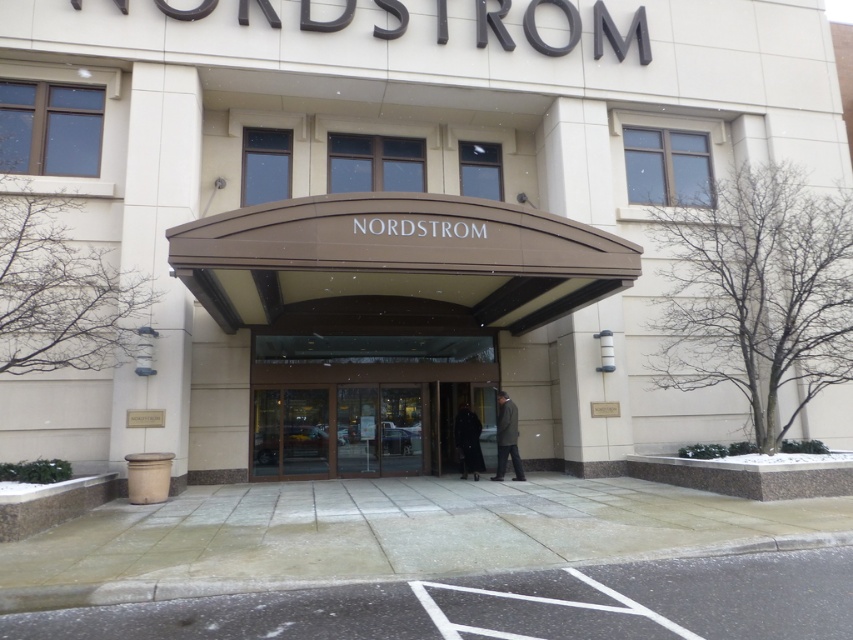
Who is taller, transparent glass doors at center or dark gray suit at center?

transparent glass doors at center

I want to click on transparent glass doors at center, so click(363, 401).

Image resolution: width=853 pixels, height=640 pixels. In order to click on dark gray suit at center in this screenshot , I will do `click(506, 436)`.

Between dark gray suit at center and dark wool coat at center, which one appears on the left side from the viewer's perspective?

dark wool coat at center

Identify the location of dark gray suit at center. The image size is (853, 640). (506, 436).

The image size is (853, 640). Identify the location of dark gray suit at center. (506, 436).

Which is below, black leather coat at center or dark wool coat at center?

Positioned lower is dark wool coat at center.

What do you see at coordinates (466, 426) in the screenshot?
I see `black leather coat at center` at bounding box center [466, 426].

Find the location of a particular element. black leather coat at center is located at coordinates (466, 426).